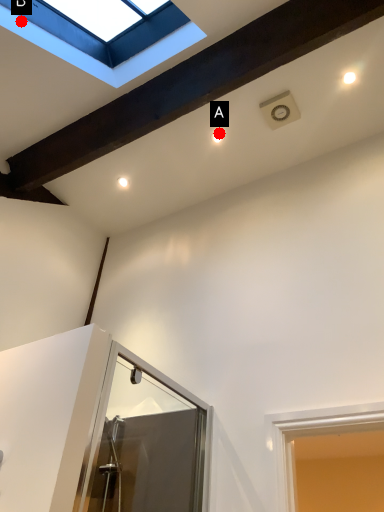
Question: Two points are circled on the image, labeled by A and B beside each circle. Which of the following is the farthest from the observer?

Choices:
 (A) A is further
 (B) B is further

Answer: (A)